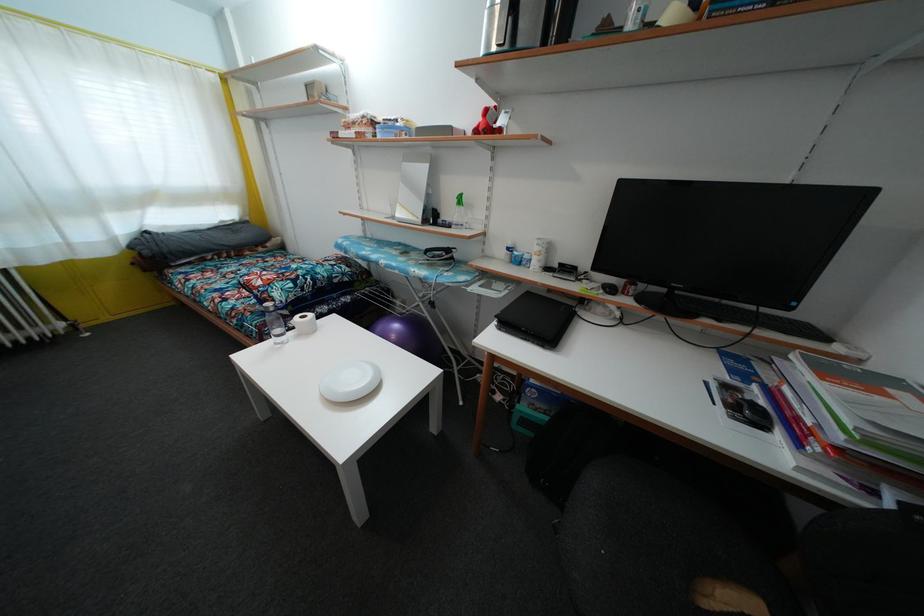
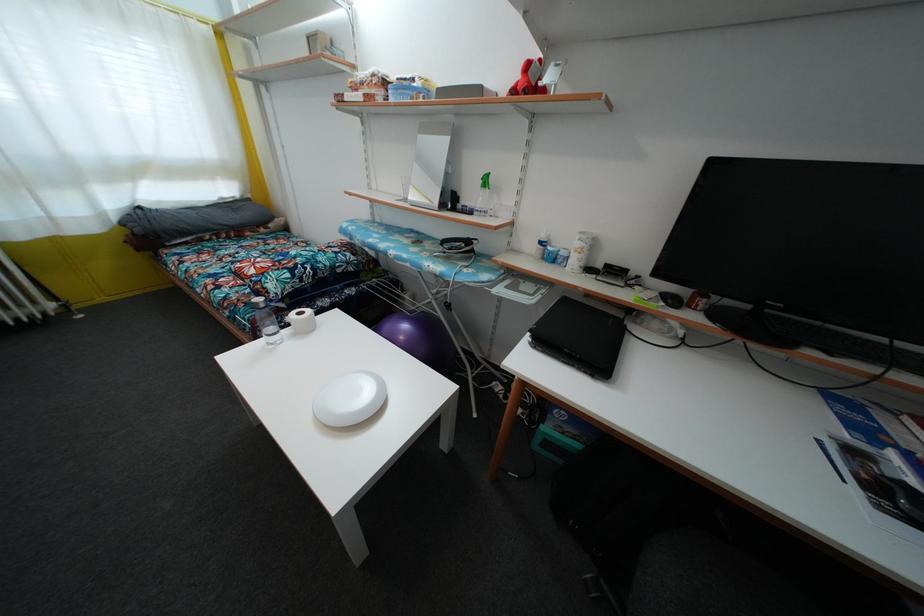
Question: The images are taken continuously from a first-person perspective. In which direction is your viewpoint rotating?

Choices:
 (A) Left
 (B) Right
 (C) Up
 (D) Down

Answer: (D)